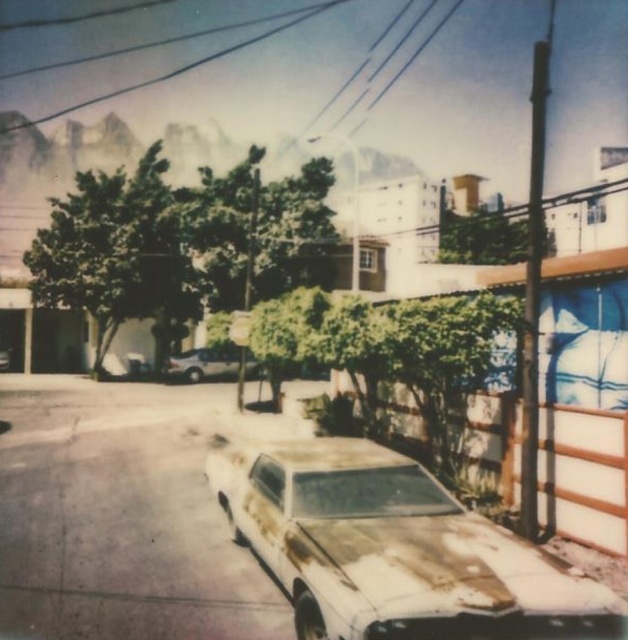
Question: In this image, where is rusty metal car at lower center located relative to rusty metallic car at center?

Choices:
 (A) above
 (B) below

Answer: (B)

Question: Can you confirm if rusty metal car at lower center is wider than rusty metallic car at center?

Choices:
 (A) no
 (B) yes

Answer: (B)

Question: In this image, where is rusty metal car at lower center located relative to rusty metallic car at center?

Choices:
 (A) below
 (B) above

Answer: (A)

Question: Which point appears closest to the camera in this image?

Choices:
 (A) (192, 376)
 (B) (519, 596)

Answer: (B)

Question: Which object is closer to the camera taking this photo?

Choices:
 (A) rusty metal car at lower center
 (B) rusty metallic car at center

Answer: (A)